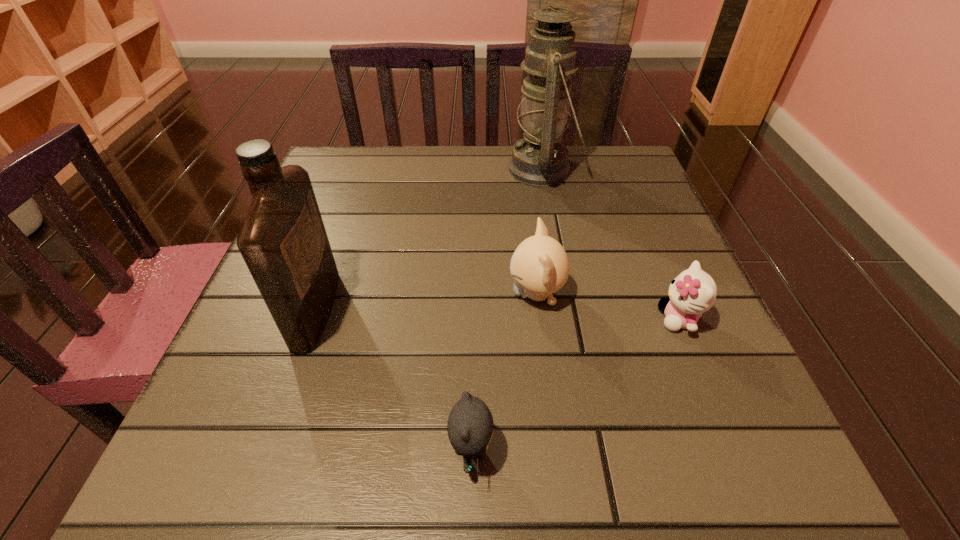
This screenshot has height=540, width=960. I want to click on the second closest kitten relative to the tallest kitten, so click(x=470, y=423).

This screenshot has height=540, width=960. What are the coordinates of `kitten that stands as the third closest to the oil lamp` in the screenshot? It's located at click(x=470, y=423).

You are a GUI agent. You are given a task and a screenshot of the screen. Output one action in this format:
    pyautogui.click(x=<x>, y=<y>)
    Task: Click on the vacant region that satisfies the following two spatial constraints: 1. on the front side of the farthest object; 2. on the front-facing side of the leftmost kitten
    This screenshot has height=540, width=960.
    Given the screenshot: What is the action you would take?
    pyautogui.click(x=595, y=450)

Where is `blank area in the image that satisfies the following two spatial constraints: 1. on the front side of the oil lamp; 2. on the front-facing side of the nearest object`? blank area in the image that satisfies the following two spatial constraints: 1. on the front side of the oil lamp; 2. on the front-facing side of the nearest object is located at coordinates (595, 450).